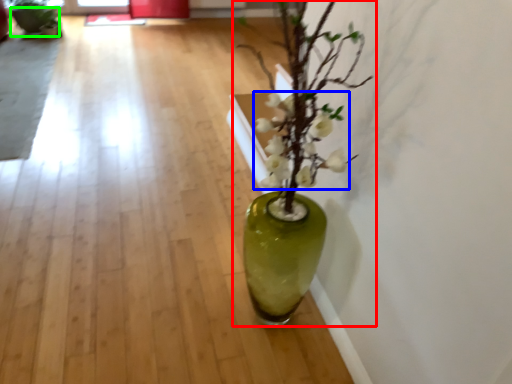
Question: Based on their relative distances, which object is nearer to houseplant (highlighted by a red box)? Choose from flower (highlighted by a blue box) and flowerpot (highlighted by a green box).

Choices:
 (A) flower
 (B) flowerpot

Answer: (A)